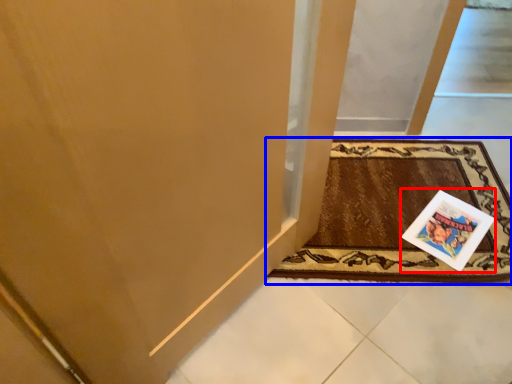
Question: Which object is closer to the camera taking this photo, postcard (highlighted by a red box) or mat (highlighted by a blue box)?

Choices:
 (A) postcard
 (B) mat

Answer: (B)